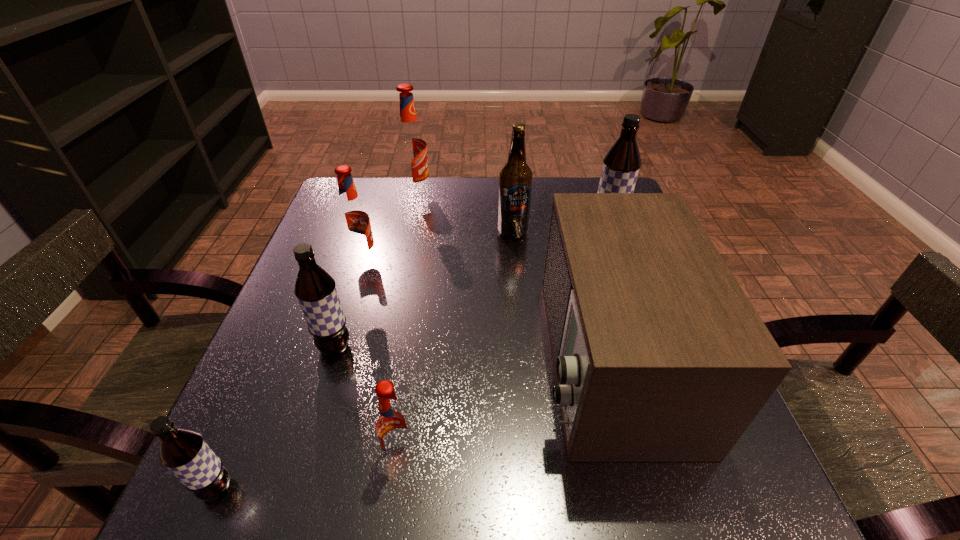
In the image, there is a desktop. Where is `free region at the left edge`? The width and height of the screenshot is (960, 540). free region at the left edge is located at coordinates (314, 408).

Locate an element on the screen. vacant space at the far left corner of the desktop is located at coordinates (360, 180).

Where is `vacant space at the near left corner of the desktop`? Image resolution: width=960 pixels, height=540 pixels. vacant space at the near left corner of the desktop is located at coordinates (301, 503).

I want to click on free spot at the near right corner of the desktop, so click(x=662, y=489).

At what (x,y) coordinates should I click in order to perform the action: click on free space that is in between the farthest red root beer and the radio receiver. Please return your answer as a coordinate pair (x, y). The image size is (960, 540). Looking at the image, I should click on (513, 276).

The image size is (960, 540). I want to click on empty location between the second brown root beer from right to left and the nearest red root beer, so click(x=368, y=401).

You are a GUI agent. You are given a task and a screenshot of the screen. Output one action in this format:
    pyautogui.click(x=<x>, y=<y>)
    Task: Click on the vacant space that's between the second nearest brown root beer and the radio receiver
    Image resolution: width=960 pixels, height=540 pixels.
    Given the screenshot: What is the action you would take?
    pyautogui.click(x=472, y=353)

Identify the location of vacant area that lies between the beer bottle and the nearest red root beer. This screenshot has height=540, width=960. (457, 343).

Locate an element on the screen. This screenshot has height=540, width=960. empty location between the leftmost object and the fifth farthest root beer is located at coordinates (308, 471).

What are the coordinates of `free space between the nearest object and the fourth farthest root beer` in the screenshot? It's located at (276, 418).